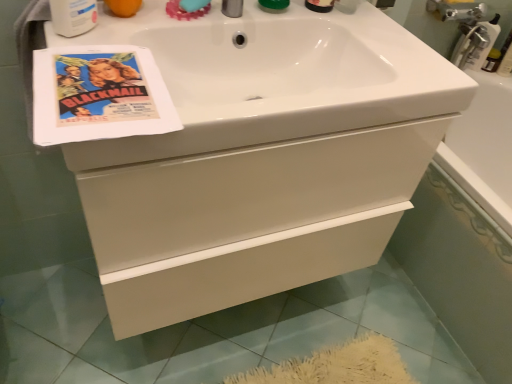
You are a GUI agent. You are given a task and a screenshot of the screen. Output one action in this format:
    pyautogui.click(x=<x>, y=<y>)
    Task: Click on the vacant area that is in front of white plastic mouthwash at upper left
    
    Given the screenshot: What is the action you would take?
    pyautogui.click(x=82, y=67)